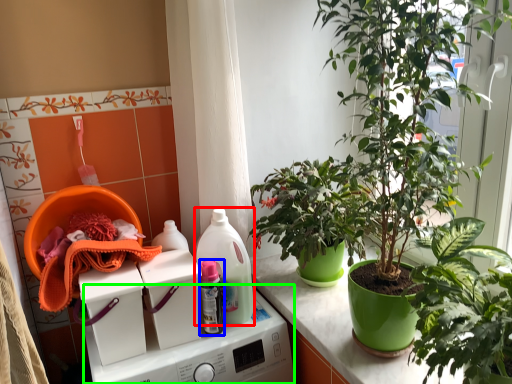
Question: Which object is positioned closest to cleaning product (highlighted by a red box)? Select from bottle (highlighted by a blue box) and washing machine (highlighted by a green box).

Choices:
 (A) bottle
 (B) washing machine

Answer: (A)